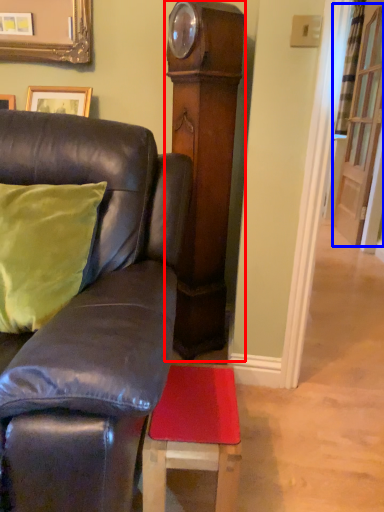
Question: Which object is further to the camera taking this photo, side (highlighted by a red box) or glass door (highlighted by a blue box)?

Choices:
 (A) side
 (B) glass door

Answer: (B)